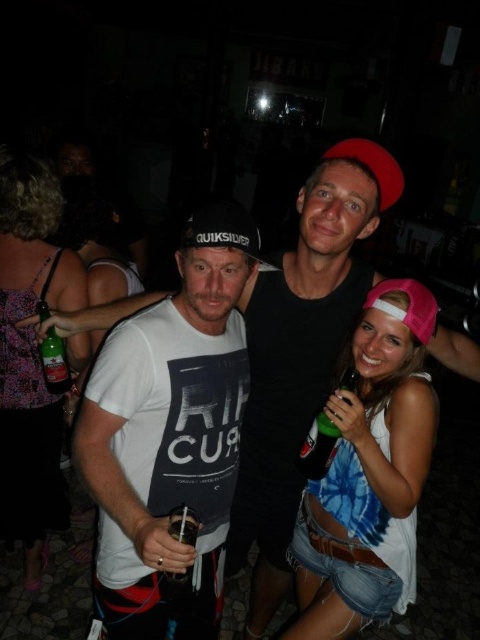
Does white matte t-shirt at center have a smaller size compared to green glass bottle at left?

Actually, white matte t-shirt at center might be larger than green glass bottle at left.

The image size is (480, 640). What do you see at coordinates (169, 432) in the screenshot? I see `white matte t-shirt at center` at bounding box center [169, 432].

Find the location of `white matte t-shirt at center`. white matte t-shirt at center is located at coordinates (169, 432).

Which is in front, point (290, 266) or point (60, 372)?

Point (290, 266) is in front.

Where is `white cotton t-shirt at center`? white cotton t-shirt at center is located at coordinates (307, 317).

Does printed fabric dress at left have a larger size compared to green matte bottle at lower right?

Indeed, printed fabric dress at left has a larger size compared to green matte bottle at lower right.

Which is behind, point (23, 480) or point (307, 470)?

Point (23, 480)

Between point (40, 481) and point (358, 380), which one is positioned in front?

Point (358, 380) is more forward.

Where is `printed fabric dress at left`? printed fabric dress at left is located at coordinates (29, 353).